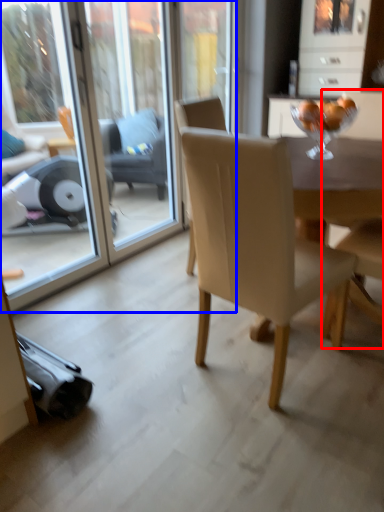
Question: Which point is further to the camera, armchair (highlighted by a red box) or screen door (highlighted by a blue box)?

Choices:
 (A) armchair
 (B) screen door

Answer: (B)